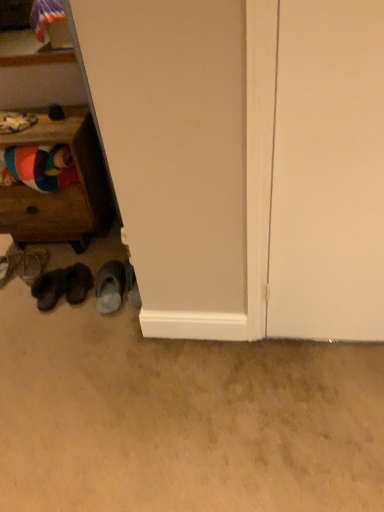
Question: Would you say gray fuzzy slippers at lower left, the 5th footwear when ordered from left to right, is inside or outside leather sandal at lower left, the first footwear viewed from the left?

Choices:
 (A) outside
 (B) inside

Answer: (A)

Question: From a real-world perspective, is gray fuzzy slippers at lower left, the 1th footwear when ordered from right to left, physically located above or below leather sandal at lower left, the first footwear viewed from the left?

Choices:
 (A) above
 (B) below

Answer: (A)

Question: Considering the real-world distances, which object is farthest from the multicolored fabric at left?

Choices:
 (A) gray fuzzy slippers at lower left, the 1th footwear when ordered from right to left
 (B) white matte door at right
 (C) leather sandal at lower left, which is counted as the 2th footwear, starting from the left
 (D) wooden drawer at left
 (E) dark gray suede slippers at lower left, the 3th footwear when ordered from right to left

Answer: (B)

Question: Which object is positioned closest to the brown suede shoes at lower left, the fourth footwear positioned from the left?

Choices:
 (A) wooden drawer at left
 (B) dark gray suede slippers at lower left, the 3th footwear when ordered from right to left
 (C) multicolored fabric at left
 (D) white matte door at right
 (E) leather sandal at lower left, the 4th footwear positioned from the right

Answer: (B)